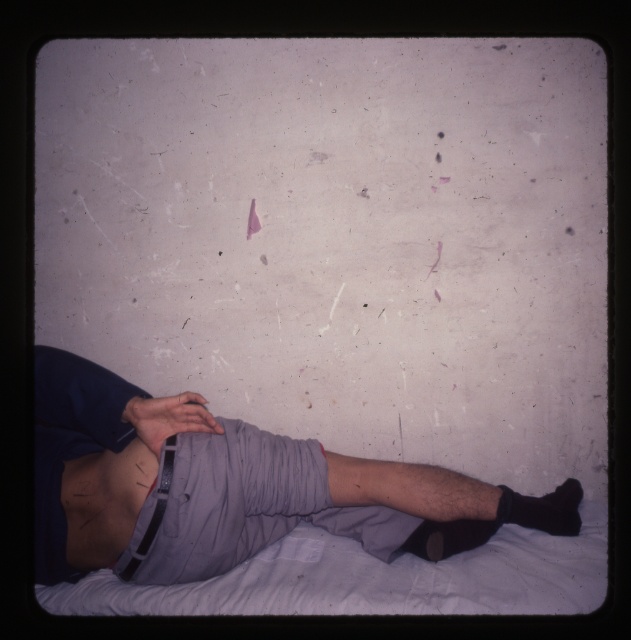
Question: Which object appears farthest from the camera in this image?

Choices:
 (A) black matte sock at lower right
 (B) gray cotton shorts at center

Answer: (A)

Question: Which of the following is the closest to the observer?

Choices:
 (A) gray cotton shorts at center
 (B) white fabric bed at lower center
 (C) black matte sock at lower right

Answer: (B)

Question: Where is white fabric bed at lower center located in relation to black matte sock at lower right in the image?

Choices:
 (A) below
 (B) above

Answer: (A)

Question: Among these points, which one is nearest to the camera?

Choices:
 (A) (133, 609)
 (B) (194, 400)
 (C) (68, 502)
 (D) (570, 502)

Answer: (B)

Question: Is gray cotton shorts at center above white fabric bed at lower center?

Choices:
 (A) no
 (B) yes

Answer: (B)

Question: Can you confirm if gray cotton shorts at center is wider than black matte sock at lower right?

Choices:
 (A) yes
 (B) no

Answer: (A)